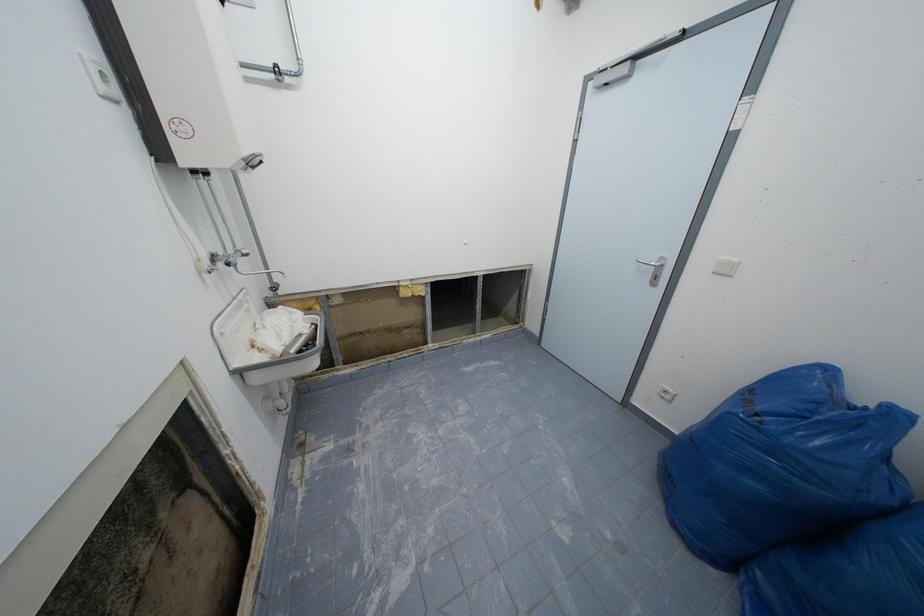
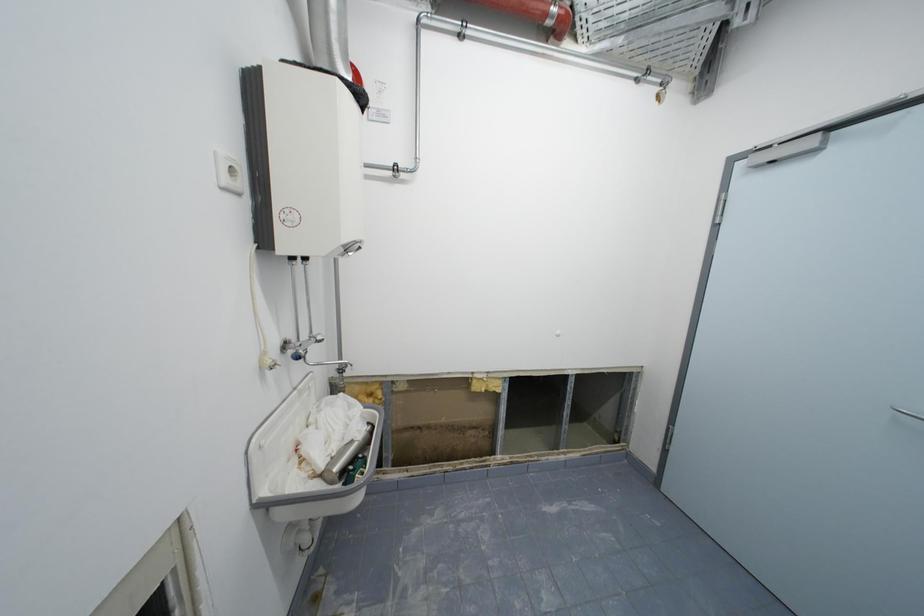
Question: The first image is from the beginning of the video and the second image is from the end. How did the camera likely rotate when shooting the video?

Choices:
 (A) Left
 (B) Right
 (C) Up
 (D) Down

Answer: (A)